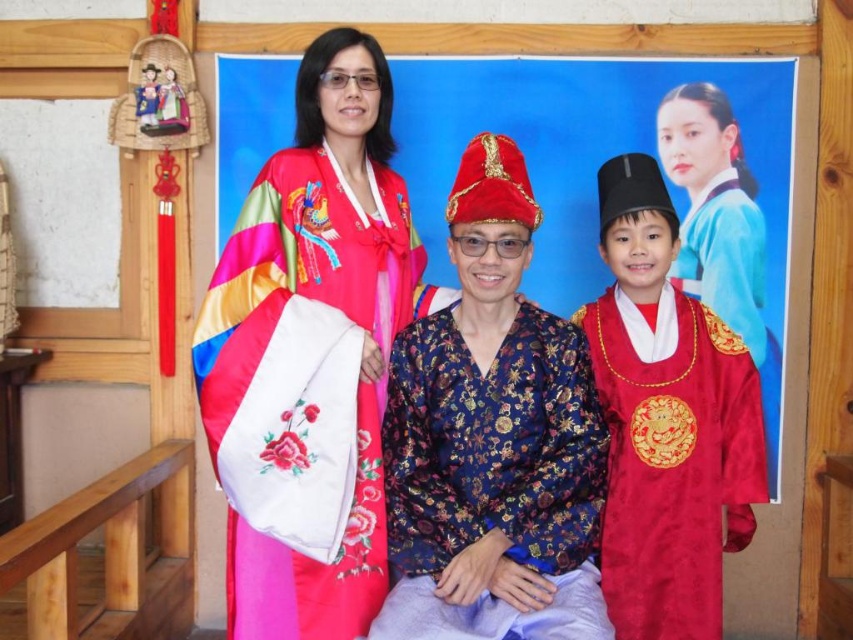
You are an interior designer planning to hang two decorative items in a room. The first item is the silky satin kimono at upper left and the second is the shiny brocade robe at center. Based on the scene provided, where should each item be placed to maintain the original spatial relationship between them?

The silky satin kimono at upper left should be placed above the shiny brocade robe at center to maintain their original spatial relationship as depicted in the scene.

In the scene shown: You are standing in the room and see two points marked on the floor. The first point is at coordinate point(297,588) and the second is at point(621,189). Which point is closer to you?

Point(297,588) is in front of point(621,189), so it is closer to you.

You are standing in a room with three people wearing hanbok. The person on the left has a white apron, the center person has a dark blue hanbok with gold designs, and the person on the right has a black hat. There is a framed picture on the wall. If you look at the point marked at coordinates (666,420), what object is located there?

The point at coordinates (666,420) marks the location of the silky red robe at center.